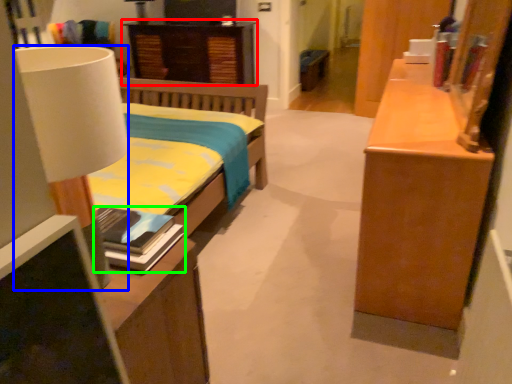
Question: Estimate the real-world distances between objects in this image. Which object is closer to nightstand (highlighted by a red box), lamp (highlighted by a blue box) or book (highlighted by a green box)?

Choices:
 (A) lamp
 (B) book

Answer: (B)